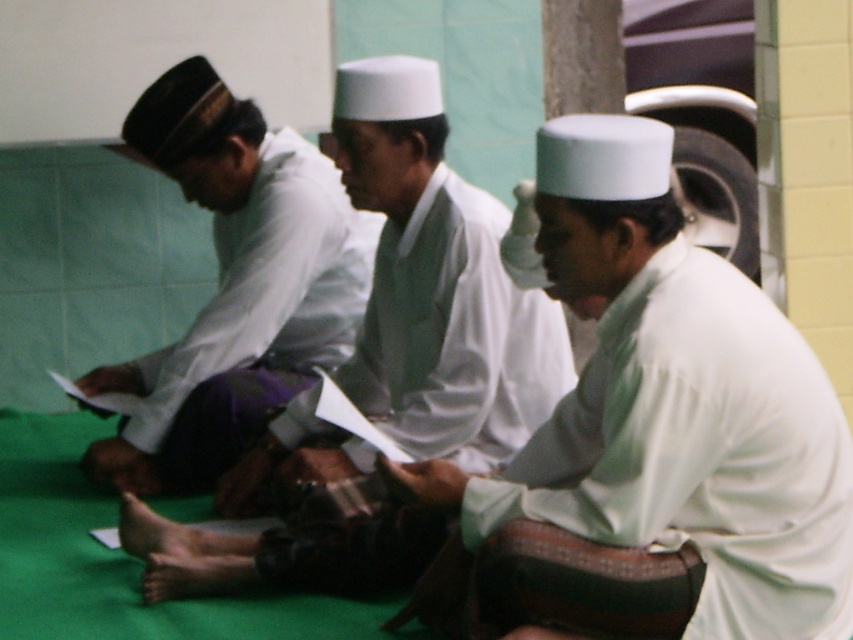
Question: Which object is positioned farthest from the light green fabric at center?

Choices:
 (A) white matte hat at center
 (B) matte white shirt at center

Answer: (B)

Question: Among these points, which one is farthest from the camera?

Choices:
 (A) (281, 419)
 (B) (82, 465)

Answer: (B)

Question: Does white matte hat at center lie in front of matte white shirt at center?

Choices:
 (A) yes
 (B) no

Answer: (A)

Question: Considering the relative positions of white matte hat at center and matte white shirt at center in the image provided, where is white matte hat at center located with respect to matte white shirt at center?

Choices:
 (A) left
 (B) right

Answer: (B)

Question: Is light green fabric at center smaller than white matte hat at center?

Choices:
 (A) no
 (B) yes

Answer: (B)

Question: Which of the following is the farthest from the observer?

Choices:
 (A) (244, 211)
 (B) (426, 432)
 (C) (724, 461)

Answer: (A)